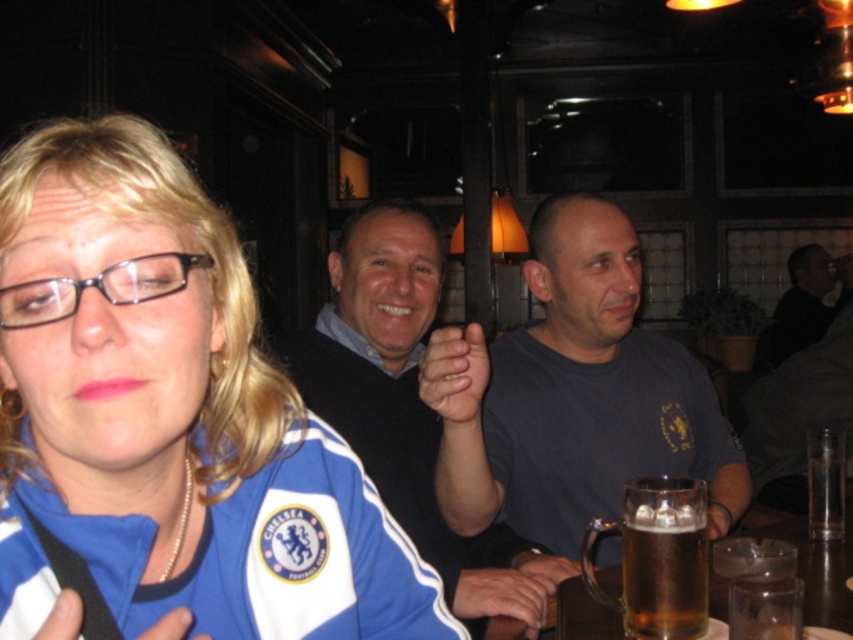
What are the coordinates of the translucent glass mug at lower right?

The coordinates of the translucent glass mug at lower right are at point (657, 557).